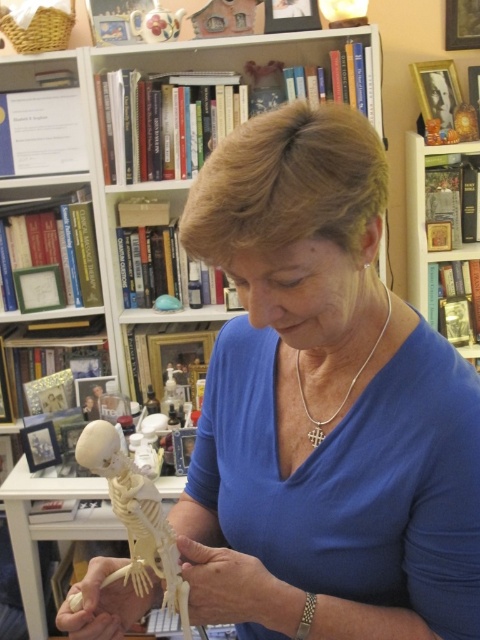
Question: From the image, what is the correct spatial relationship of white matte bone at lower center in relation to smooth skin hand at center?

Choices:
 (A) right
 (B) left

Answer: (B)

Question: Which object appears closest to the camera in this image?

Choices:
 (A) transparent plastic skeleton at lower left
 (B) silver cross at center
 (C) translucent plastic hand at center

Answer: (A)

Question: Which point appears closest to the camera in this image?

Choices:
 (A) (204, 563)
 (B) (91, 456)
 (C) (361, 369)
 (D) (122, 586)

Answer: (B)

Question: Does transparent plastic skeleton at lower left lie in front of smooth skin hand at center?

Choices:
 (A) no
 (B) yes

Answer: (B)

Question: Is transparent plastic skeleton at lower left bigger than smooth skin hand at center?

Choices:
 (A) yes
 (B) no

Answer: (A)

Question: Which point is farther to the camera?

Choices:
 (A) (231, 618)
 (B) (202, 576)
 (C) (303, 408)

Answer: (C)